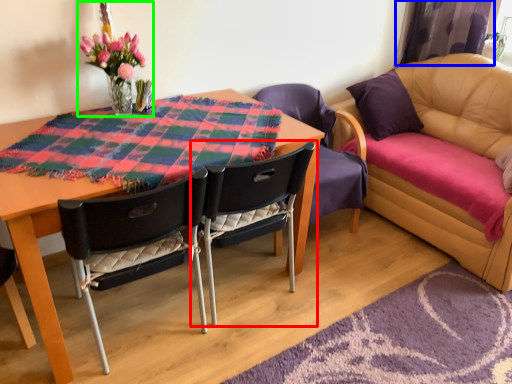
Question: Which is nearer to the chair (highlighted by a red box)? curtain (highlighted by a blue box) or floral arrangement (highlighted by a green box).

Choices:
 (A) curtain
 (B) floral arrangement

Answer: (B)